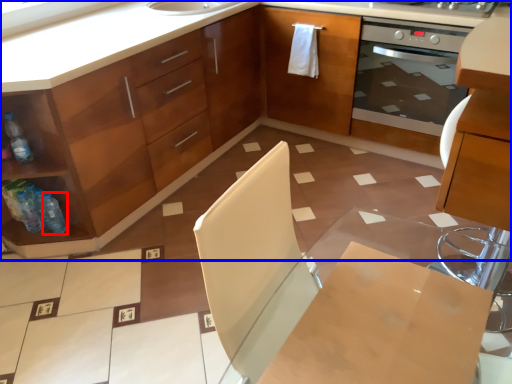
Question: Among these objects, which one is nearest to the camera, bottle (highlighted by a red box) or cabinetry (highlighted by a blue box)?

Choices:
 (A) bottle
 (B) cabinetry

Answer: (B)